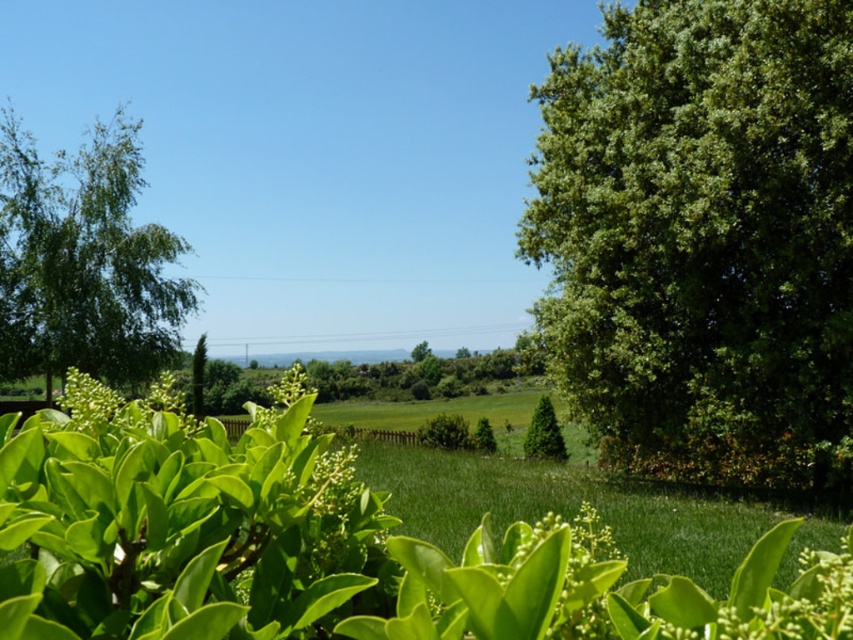
You are a bird looking for a nesting spot. You see two trees in the scene, the green leafy tree at right and the green leafy tree at left. Which tree would you choose if you prefer a larger tree for nesting?

The green leafy tree at right is bigger than the green leafy tree at left, so the bird should choose the green leafy tree at right for nesting.

You are a landscape architect planning to place a new bench between the green leafy tree at right and the green matte evergreen tree at center. Based on their widths, which tree would allow more space for people to walk around it?

The green leafy tree at right might be wider than the green matte evergreen tree at center, so it would require more space around it, leaving less room for walking. Therefore, placing the bench near the green matte evergreen tree at center would allow more space for people to walk around.

You are a gardener planning to plant a new tree in the field between the green leafy tree at right and the green leafy tree at left. Considering their widths, which tree should you use as a reference to ensure the new tree has enough space?

The green leafy tree at right has a smaller width than the green leafy tree at left. To ensure enough space, the gardener should use the width of the green leafy tree at left as a reference for spacing the new tree.